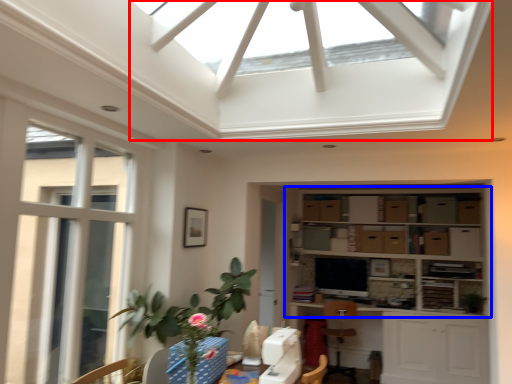
Question: Which of the following is the farthest to the observer, exhaust hood (highlighted by a red box) or shelf (highlighted by a blue box)?

Choices:
 (A) exhaust hood
 (B) shelf

Answer: (B)